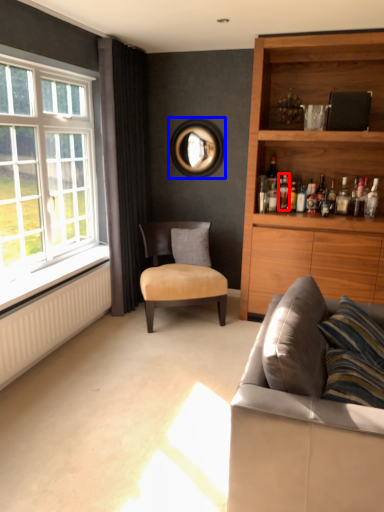
Question: Which of the following is the farthest to the observer, bottle (highlighted by a red box) or picture frame (highlighted by a blue box)?

Choices:
 (A) bottle
 (B) picture frame

Answer: (B)